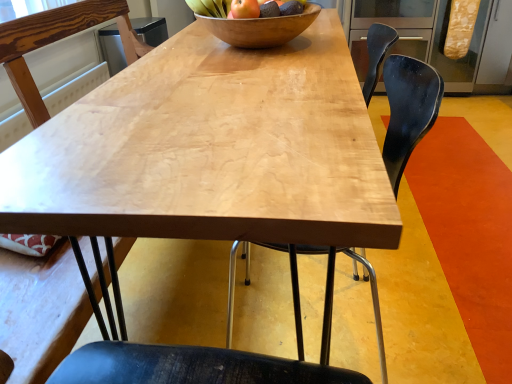
Question: From the image's perspective, is black matte chair at center, placed as the 2th chair when sorted from right to left, on matte brown apple at center?

Choices:
 (A) yes
 (B) no

Answer: (B)

Question: Can you confirm if black matte chair at center, placed as the 2th chair when sorted from right to left, is wider than matte brown apple at center?

Choices:
 (A) no
 (B) yes

Answer: (B)

Question: Is black matte chair at center, placed as the 2th chair when sorted from right to left, bigger than matte brown apple at center?

Choices:
 (A) no
 (B) yes

Answer: (B)

Question: Would you say matte brown apple at center is part of black matte chair at center, placed as the 2th chair when sorted from right to left,'s contents?

Choices:
 (A) no
 (B) yes

Answer: (A)

Question: Is black matte chair at center, which is counted as the second chair, starting from the left, aimed at matte brown apple at center?

Choices:
 (A) no
 (B) yes

Answer: (A)

Question: In terms of size, does black plastic chair at center, which is counted as the third chair, starting from the left, appear bigger or smaller than matte brown apple at center?

Choices:
 (A) big
 (B) small

Answer: (A)

Question: Is point (429, 117) positioned closer to the camera than point (248, 9)?

Choices:
 (A) closer
 (B) farther

Answer: (A)

Question: In the image, is black plastic chair at center, the 1th chair in the right-to-left sequence, positioned in front of or behind matte brown apple at center?

Choices:
 (A) behind
 (B) front

Answer: (B)

Question: Would you say black plastic chair at center, which is counted as the third chair, starting from the left, is to the left or to the right of matte brown apple at center in the picture?

Choices:
 (A) right
 (B) left

Answer: (A)

Question: From the image's perspective, is black matte chair at center, placed as the 2th chair when sorted from right to left, above or below wooden bowl at center?

Choices:
 (A) above
 (B) below

Answer: (B)

Question: Considering the positions of black matte chair at center, placed as the 2th chair when sorted from right to left, and wooden bowl at center in the image, is black matte chair at center, placed as the 2th chair when sorted from right to left, bigger or smaller than wooden bowl at center?

Choices:
 (A) big
 (B) small

Answer: (A)

Question: Would you say black matte chair at center, placed as the 2th chair when sorted from right to left, is to the left or to the right of wooden bowl at center in the picture?

Choices:
 (A) right
 (B) left

Answer: (A)

Question: Is black matte chair at center, placed as the 2th chair when sorted from right to left, inside or outside of wooden bowl at center?

Choices:
 (A) inside
 (B) outside

Answer: (B)

Question: Is wooden bowl at center situated inside shiny wooden bowl at upper center or outside?

Choices:
 (A) inside
 (B) outside

Answer: (B)

Question: From the image's perspective, relative to shiny wooden bowl at upper center, is wooden bowl at center above or below?

Choices:
 (A) below
 (B) above

Answer: (A)